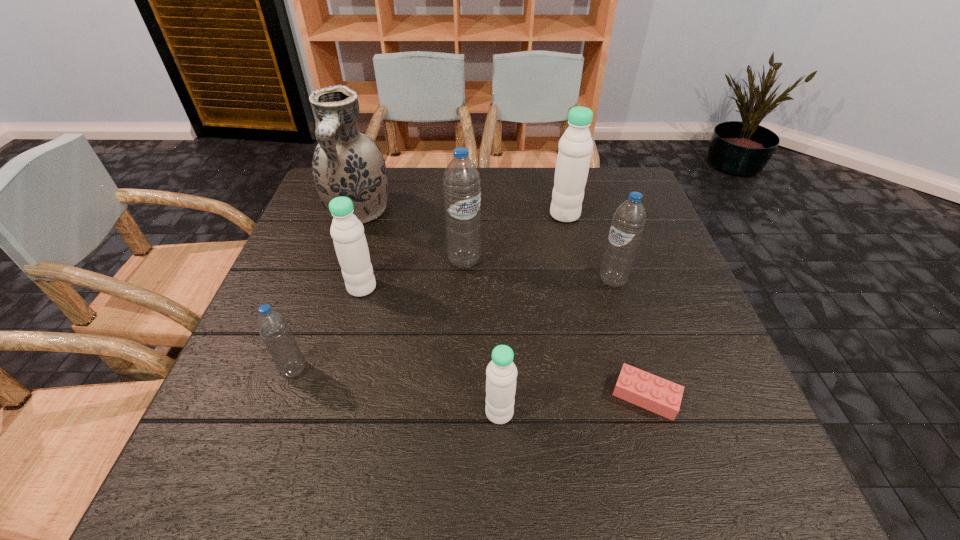
Locate an element on the screen. blue vase is located at coordinates (346, 163).

At what (x,y) coordinates should I click in order to perform the action: click on the biggest white water bottle. Please return your answer as a coordinate pair (x, y). This screenshot has width=960, height=540. Looking at the image, I should click on (575, 146).

Where is `the farthest white water bottle`? This screenshot has width=960, height=540. the farthest white water bottle is located at coordinates (575, 146).

I want to click on the fourth object from left to right, so click(461, 182).

Where is `the fourth water bottle from right to left`? the fourth water bottle from right to left is located at coordinates (461, 182).

The width and height of the screenshot is (960, 540). I want to click on the rightmost water bottle, so click(x=627, y=226).

Locate an element on the screen. The height and width of the screenshot is (540, 960). the rightmost blue water bottle is located at coordinates (627, 226).

The image size is (960, 540). I want to click on the second biggest white water bottle, so click(347, 231).

Where is `the leftmost white water bottle`? the leftmost white water bottle is located at coordinates (347, 231).

This screenshot has height=540, width=960. In order to click on the leftmost water bottle in this screenshot , I will do `click(272, 325)`.